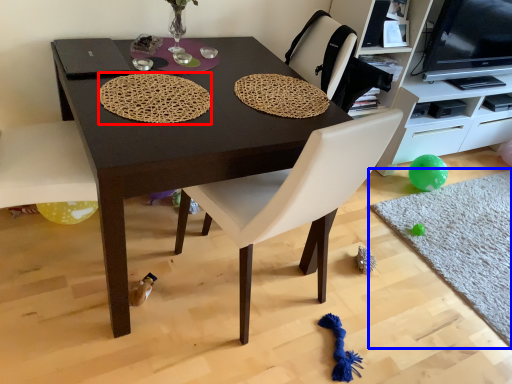
Question: Which object is closer to the camera taking this photo, mat (highlighted by a red box) or mat (highlighted by a blue box)?

Choices:
 (A) mat
 (B) mat

Answer: (A)